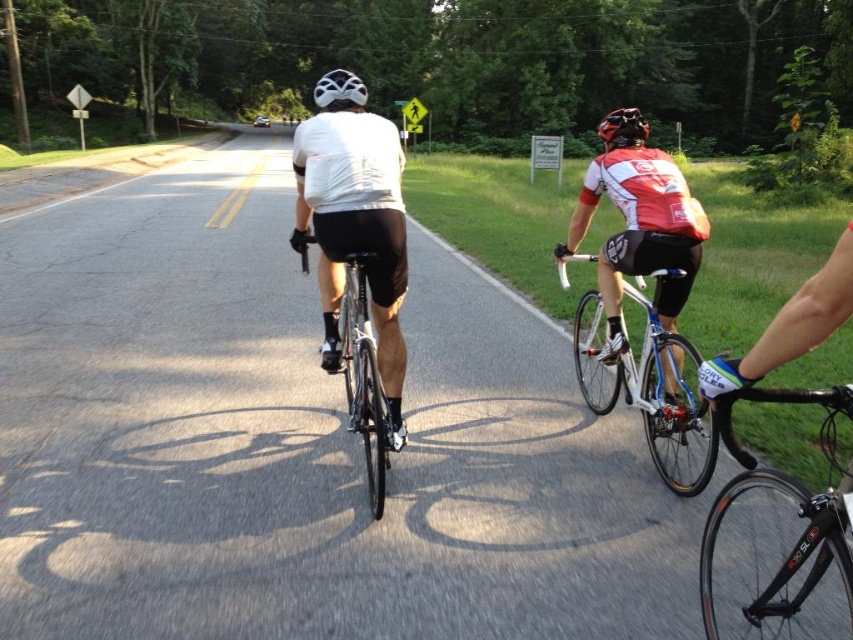
Question: Is white jersey at center above shiny silver bicycle at center?

Choices:
 (A) yes
 (B) no

Answer: (A)

Question: Observing the image, what is the correct spatial positioning of shiny silver bicycle at center in reference to matte black bicycle at center?

Choices:
 (A) right
 (B) left

Answer: (A)

Question: Which point is closer to the camera?

Choices:
 (A) (665, 352)
 (B) (828, 550)
 (C) (604, 352)

Answer: (B)

Question: Which object is positioned farthest from the matte black bicycle at center?

Choices:
 (A) white matte bicycle helmet at upper center
 (B) shiny black frame at lower right

Answer: (A)

Question: Is shiny silver bicycle at center positioned at the back of shiny black frame at lower right?

Choices:
 (A) yes
 (B) no

Answer: (A)

Question: Which is farther from the shiny silver bicycle at center?

Choices:
 (A) matte black bicycle at center
 (B) white matte bicycle helmet at upper center

Answer: (B)